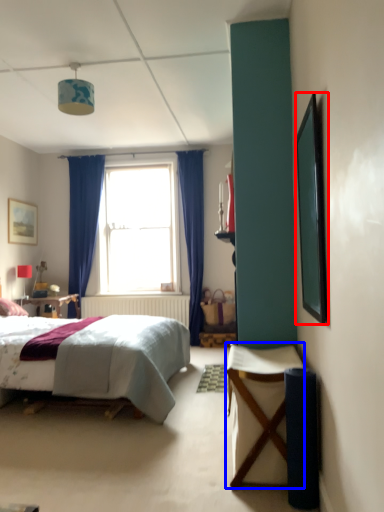
Question: Which of the following is the farthest to the observer, picture frame (highlighted by a red box) or desk (highlighted by a blue box)?

Choices:
 (A) picture frame
 (B) desk

Answer: (B)